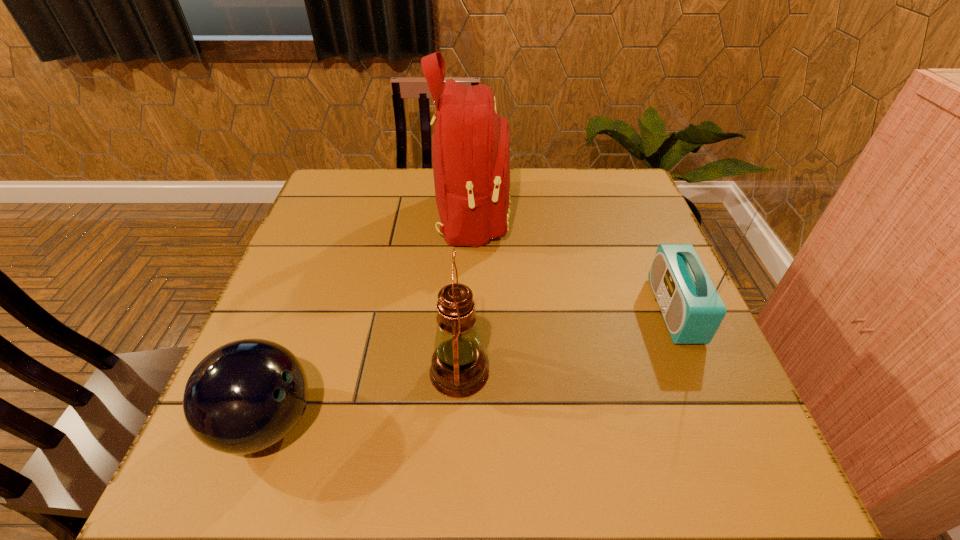
The image size is (960, 540). In the image, there is a desktop. Identify the location of vacant space at the near left corner. (234, 471).

I want to click on vacant space at the far right corner of the desktop, so click(x=594, y=213).

This screenshot has height=540, width=960. What are the coordinates of `vacant space in between the bowling ball and the backpack` in the screenshot? It's located at (370, 320).

At what (x,y) coordinates should I click in order to perform the action: click on blank region between the rightmost object and the tallest object. Please return your answer as a coordinate pair (x, y). Image resolution: width=960 pixels, height=540 pixels. Looking at the image, I should click on (573, 264).

Image resolution: width=960 pixels, height=540 pixels. Identify the location of vacant area that lies between the leftmost object and the oil lamp. (363, 397).

Locate an element on the screen. free space between the leftmost object and the tallest object is located at coordinates (370, 320).

Where is `empty location between the bowling ball and the tallest object`? The image size is (960, 540). empty location between the bowling ball and the tallest object is located at coordinates (370, 320).

You are a GUI agent. You are given a task and a screenshot of the screen. Output one action in this format:
    pyautogui.click(x=<x>, y=<y>)
    Task: Click on the object that is the second closest one to the shortest object
    The height and width of the screenshot is (540, 960).
    Given the screenshot: What is the action you would take?
    pyautogui.click(x=471, y=144)

What are the coordinates of `the second closest object to the radio receiver` in the screenshot? It's located at (459, 369).

Find the location of a particular element. Image resolution: width=960 pixels, height=540 pixels. free location that satisfies the following two spatial constraints: 1. on the front-facing side of the tallest object; 2. on the front side of the oil lamp is located at coordinates (468, 372).